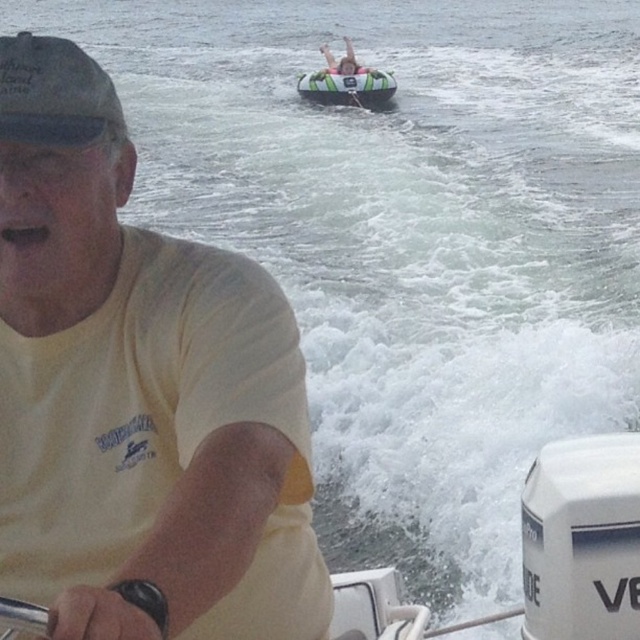
Who is more distant from viewer, (316, 76) or (360, 65)?

The point (360, 65) is more distant.

Between green inflatable raft at upper center and smooth skin human at upper center, which one is positioned higher?

smooth skin human at upper center is above.

Between point (307, 90) and point (360, 67), which one is positioned behind?

Point (360, 67)

Where is `green inflatable raft at upper center`? This screenshot has width=640, height=640. green inflatable raft at upper center is located at coordinates (348, 86).

Is point (67, 68) behind point (339, 65)?

No, it is not.

Does dark gray matte baseball cap at upper left appear under smooth skin human at upper center?

Indeed, dark gray matte baseball cap at upper left is positioned under smooth skin human at upper center.

The image size is (640, 640). Identify the location of dark gray matte baseball cap at upper left. (54, 93).

Can you confirm if yellow t-shirt at center is positioned above white plastic motor at lower right?

Indeed, yellow t-shirt at center is positioned over white plastic motor at lower right.

Who is more distant from viewer, (x=113, y=291) or (x=563, y=566)?

Positioned behind is point (x=563, y=566).

This screenshot has width=640, height=640. Describe the element at coordinates (138, 394) in the screenshot. I see `yellow t-shirt at center` at that location.

You are a GUI agent. You are given a task and a screenshot of the screen. Output one action in this format:
    pyautogui.click(x=<x>, y=<y>)
    Task: Click on the yellow t-shirt at center
    The image size is (640, 640).
    Given the screenshot: What is the action you would take?
    pyautogui.click(x=138, y=394)